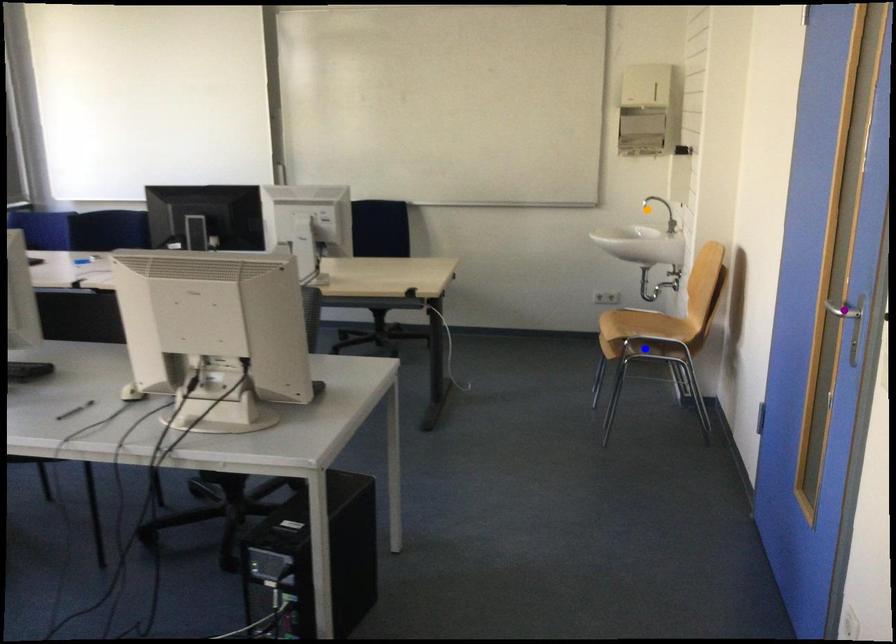
Order these from nearest to farthest:
purple point, orange point, blue point

1. purple point
2. blue point
3. orange point